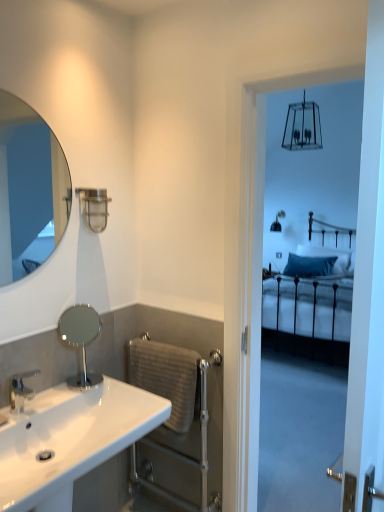
The image size is (384, 512). I want to click on vacant space underneath polished chrome mirror at center, which appears as the first mirror when ordered from the bottom (from a real-world perspective), so click(87, 380).